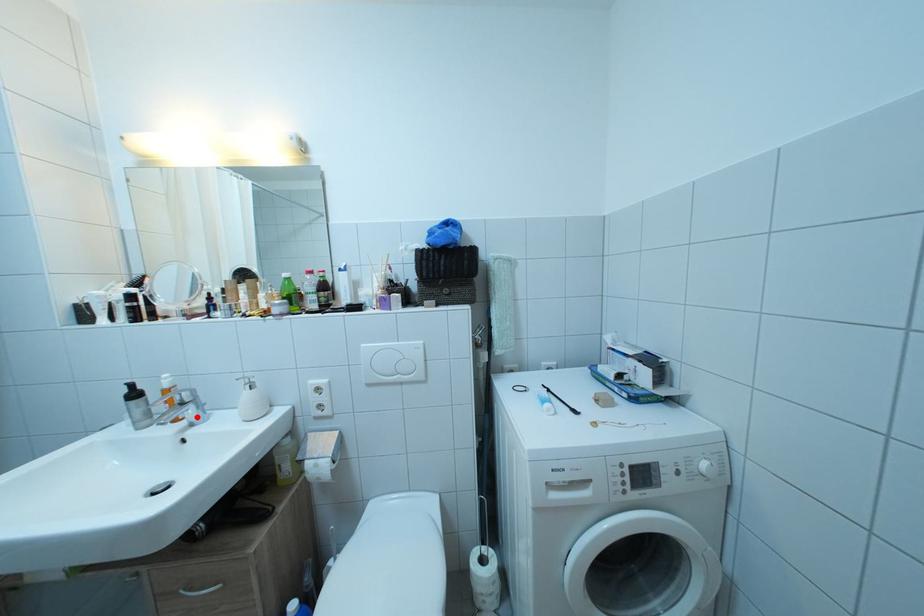
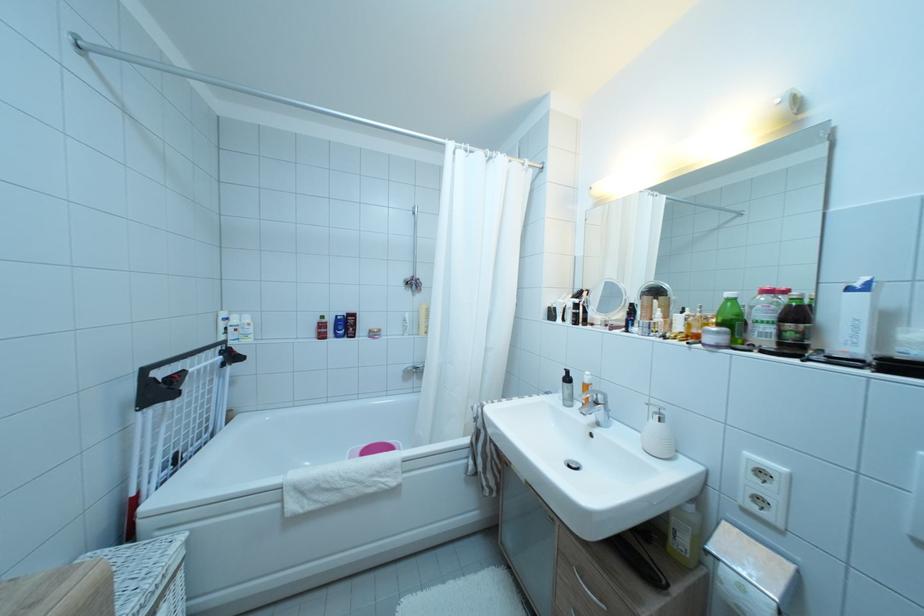
Find the pixel in the second image that matches the highlighted location in the first image.

(606, 418)